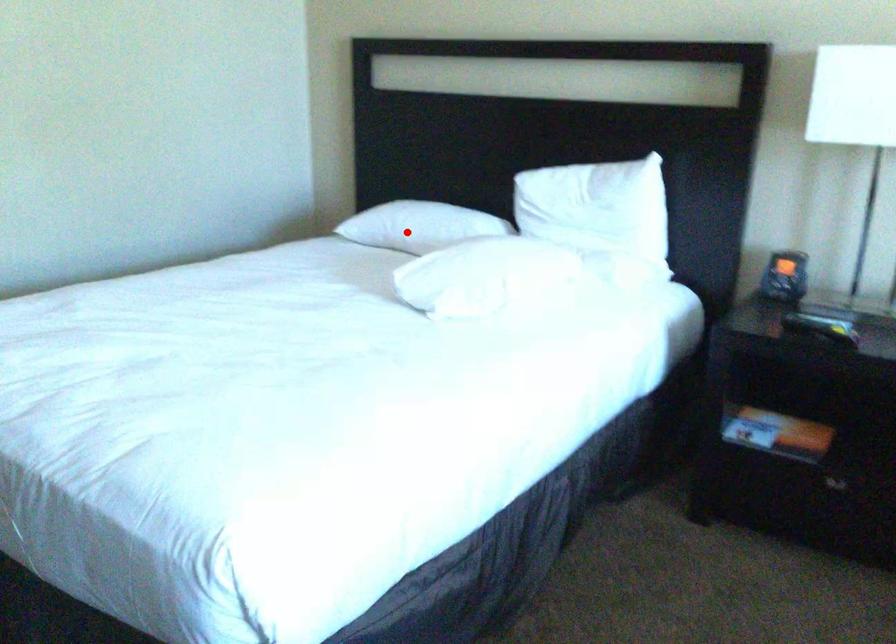
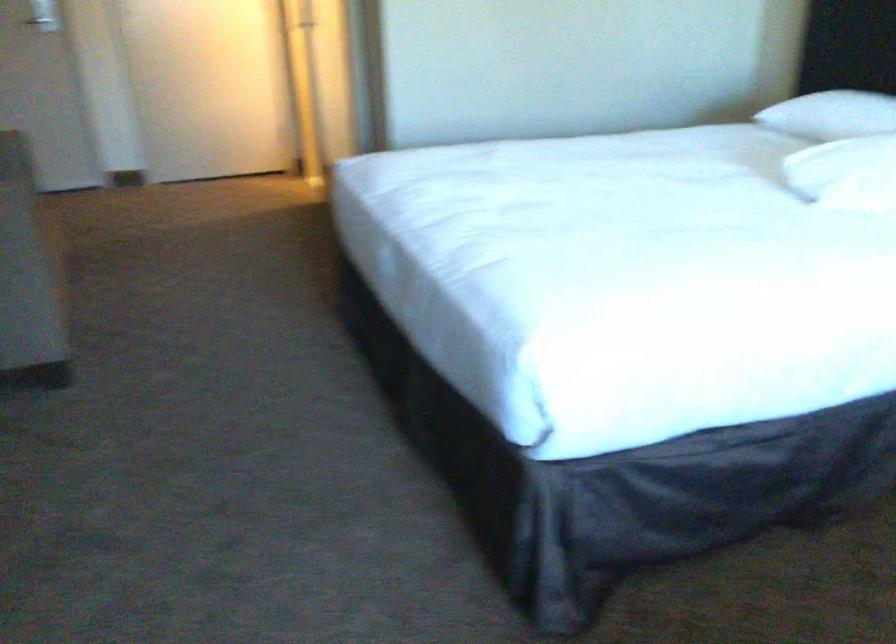
Find the pixel in the second image that matches the highlighted location in the first image.

(831, 115)